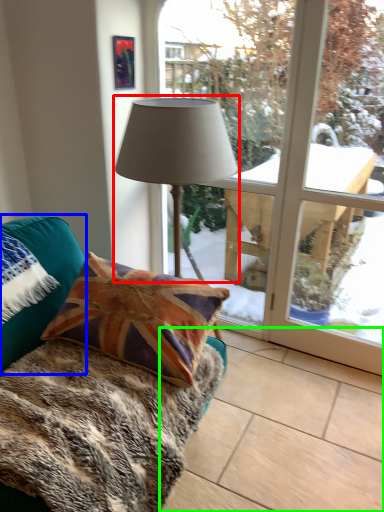
Question: Based on their relative distances, which object is farther from lamp (highlighted by a red box)? Choose from pillow (highlighted by a blue box) and tile (highlighted by a green box).

Choices:
 (A) pillow
 (B) tile

Answer: (B)